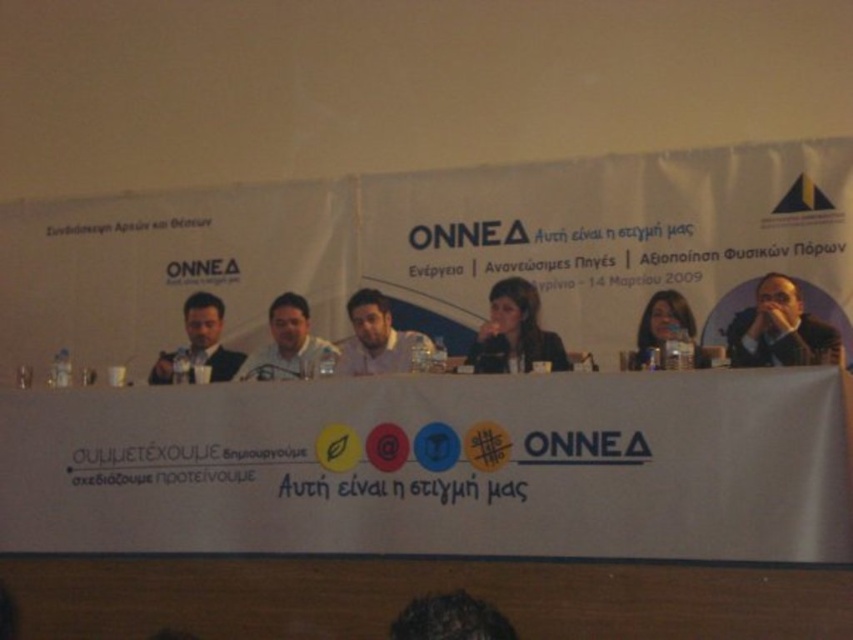
Question: Which point appears closest to the camera in this image?

Choices:
 (A) (369, 314)
 (B) (276, 371)
 (C) (468, 637)
 (D) (531, 298)

Answer: (C)

Question: Which of the following is the closest to the observer?

Choices:
 (A) matte black suit at left
 (B) dark brown suit at right

Answer: (B)

Question: Can you confirm if matte black laptop at center is smaller than dark brown hair at center?

Choices:
 (A) yes
 (B) no

Answer: (B)

Question: From the image, what is the correct spatial relationship of matte black laptop at center in relation to matte black suit at left?

Choices:
 (A) left
 (B) right

Answer: (B)

Question: Which object is the farthest from the matte black suit at left?

Choices:
 (A) dark brown hair at center
 (B) matte black laptop at center

Answer: (A)

Question: Does dark brown suit at right have a larger size compared to beige fabric shirt at center?

Choices:
 (A) no
 (B) yes

Answer: (B)